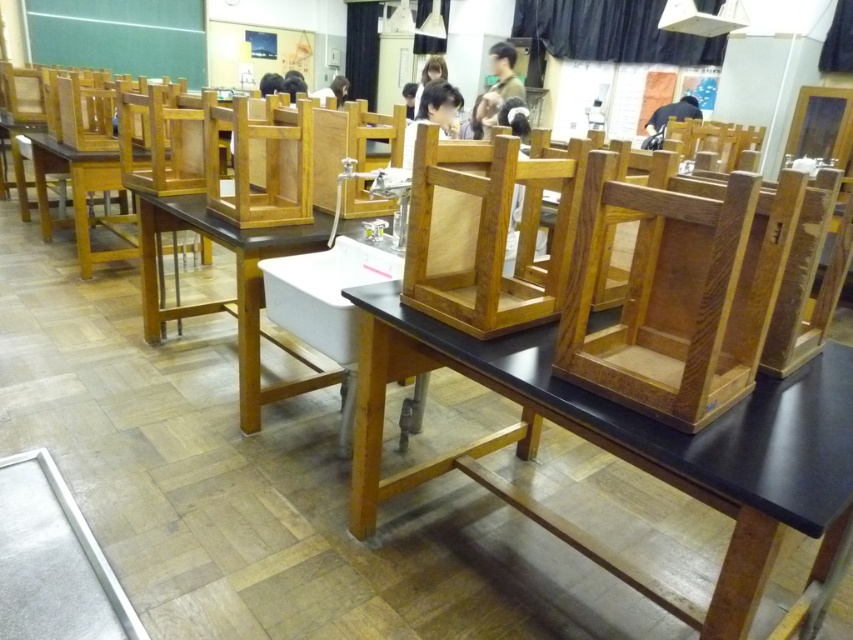
Based on the photo, does black matte hair at upper center appear on the right side of matte black laptop at center?

Yes, black matte hair at upper center is to the right of matte black laptop at center.

Can you confirm if black matte hair at upper center is taller than matte black laptop at center?

Correct, black matte hair at upper center is much taller as matte black laptop at center.

The height and width of the screenshot is (640, 853). Describe the element at coordinates (433, 115) in the screenshot. I see `black matte hair at upper center` at that location.

The image size is (853, 640). In order to click on black matte hair at upper center in this screenshot , I will do `click(433, 115)`.

Between dark brown wooden chair at upper center and dark brown hair at upper center, which one is positioned lower?

dark brown hair at upper center is below.

Measure the distance between dark brown wooden chair at upper center and camera.

dark brown wooden chair at upper center and camera are 6.95 meters apart from each other.

Image resolution: width=853 pixels, height=640 pixels. Find the location of `dark brown wooden chair at upper center`. dark brown wooden chair at upper center is located at coordinates (672, 113).

Who is higher up, wooden table at center or white matte shirt at upper center?

white matte shirt at upper center is higher up.

Is wooden table at center below white matte shirt at upper center?

Indeed, wooden table at center is positioned under white matte shirt at upper center.

Between point (256, 326) and point (329, 84), which one is positioned behind?

Point (329, 84)

The width and height of the screenshot is (853, 640). Identify the location of wooden table at center. (235, 289).